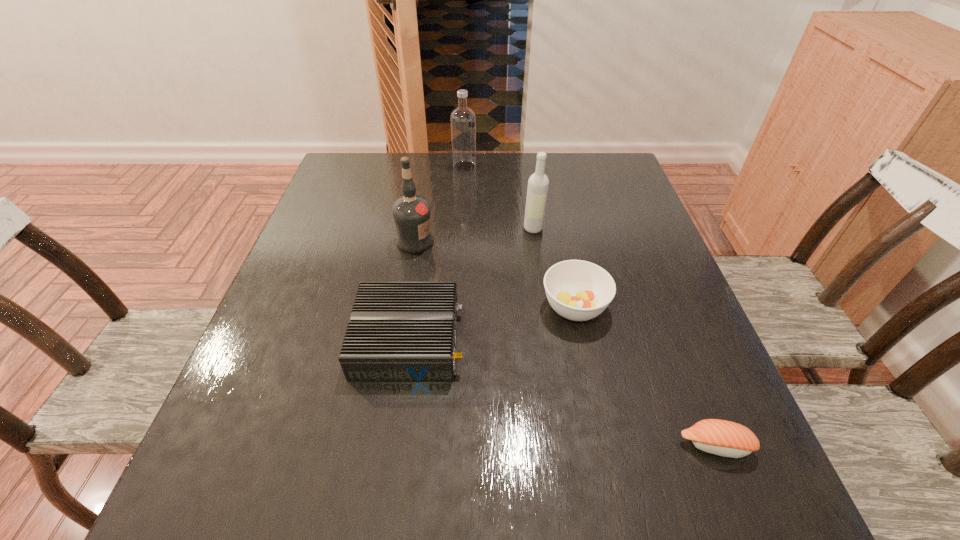
The width and height of the screenshot is (960, 540). I want to click on vacant space in between the leftmost vodka and the soup bowl, so click(495, 274).

The height and width of the screenshot is (540, 960). I want to click on vacant area that lies between the leftmost vodka and the shortest object, so click(565, 343).

You are a GUI agent. You are given a task and a screenshot of the screen. Output one action in this format:
    pyautogui.click(x=<x>, y=<y>)
    Task: Click on the free space between the sushi and the rightmost vodka
    The width and height of the screenshot is (960, 540).
    Given the screenshot: What is the action you would take?
    pyautogui.click(x=624, y=337)

Identify the location of object that is the second nearest to the rightmost vodka. (412, 215).

Point out which object is positioned as the nearest to the rightmost vodka. Please provide its 2D coordinates. Your answer should be formatted as a tuple, i.e. [(x, y)], where the tuple contains the x and y coordinates of a point satisfying the conditions above.

[(577, 290)]

Locate an element on the screen. The width and height of the screenshot is (960, 540). the second closest vodka to the farthest object is located at coordinates (412, 215).

Select which vodka appears as the second closest to the leftmost vodka. Please provide its 2D coordinates. Your answer should be formatted as a tuple, i.e. [(x, y)], where the tuple contains the x and y coordinates of a point satisfying the conditions above.

[(463, 120)]

Image resolution: width=960 pixels, height=540 pixels. In order to click on blank space that satisfies the following two spatial constraints: 1. on the front label of the second vodka from right to left; 2. on the back side of the soup bowl in this screenshot , I will do `click(457, 307)`.

You are a GUI agent. You are given a task and a screenshot of the screen. Output one action in this format:
    pyautogui.click(x=<x>, y=<y>)
    Task: Click on the vacant space that satisfies the following two spatial constraints: 1. on the back side of the soup bowl; 2. on the front label of the leftmost vodka
    Image resolution: width=960 pixels, height=540 pixels.
    Given the screenshot: What is the action you would take?
    pyautogui.click(x=562, y=242)

Locate an element on the screen. The width and height of the screenshot is (960, 540). free region that satisfies the following two spatial constraints: 1. on the back side of the shortest object; 2. on the front label of the farthest vodka is located at coordinates (605, 166).